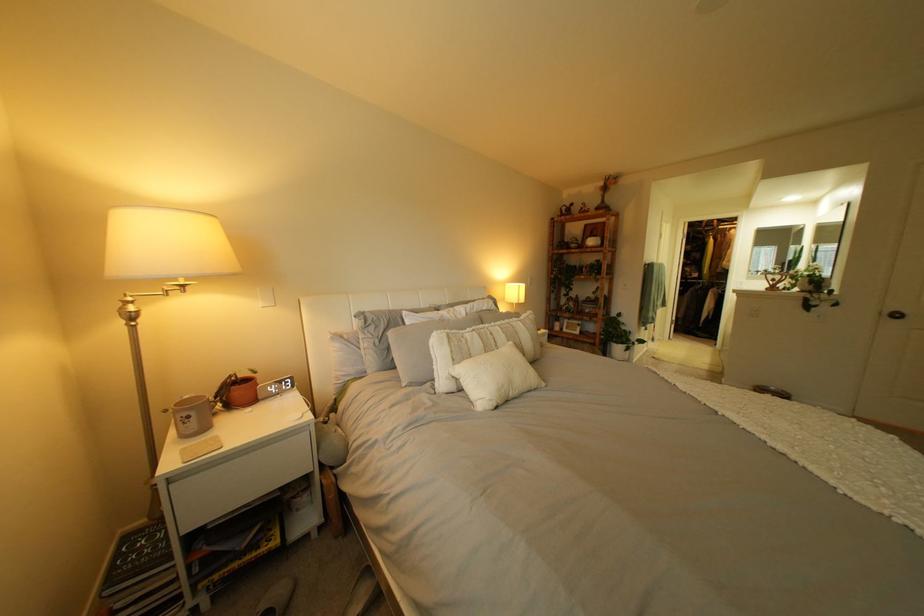
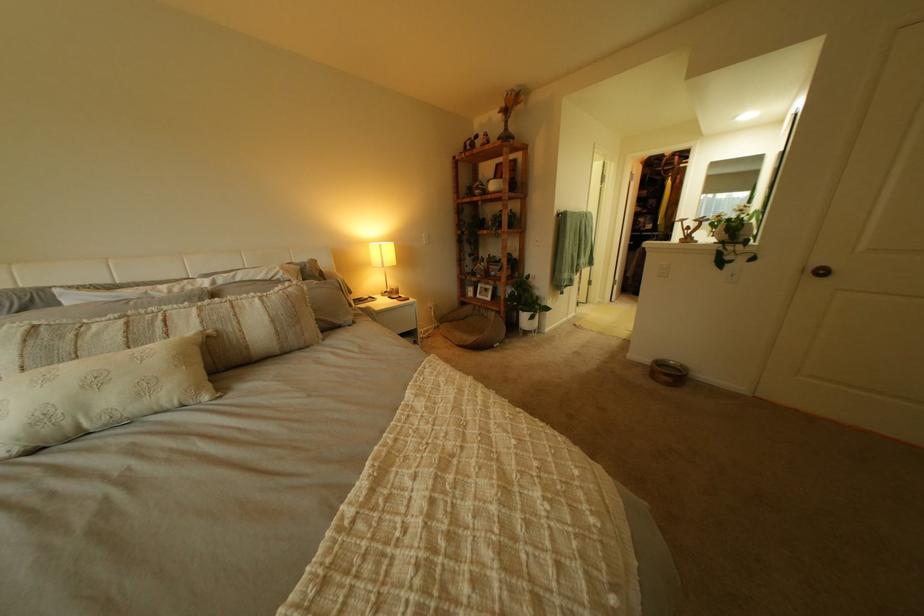
In the second image, find the point that corresponds to pixel 573 333 in the first image.

(485, 300)